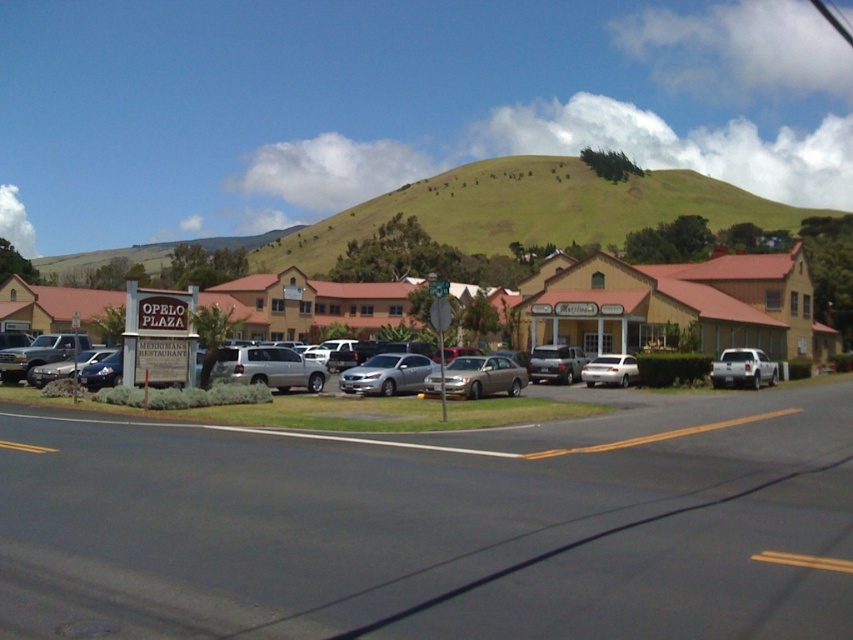
Who is more distant from viewer, (251, 257) or (552, 280)?

Point (251, 257)

Locate an element on the screen. Image resolution: width=853 pixels, height=640 pixels. green grassy hillside at upper center is located at coordinates (521, 211).

Who is taller, beige stucco building at center or white matte truck at center-right?

beige stucco building at center is taller.

Is beige stucco building at center smaller than white matte truck at center-right?

No.

You are a GUI agent. You are given a task and a screenshot of the screen. Output one action in this format:
    pyautogui.click(x=<x>, y=<y>)
    Task: Click on the beige stucco building at center
    Image resolution: width=853 pixels, height=640 pixels.
    Given the screenshot: What is the action you would take?
    pyautogui.click(x=675, y=304)

Does brown wooden motel at center appear under silver metallic sedan at center?

Incorrect, brown wooden motel at center is not positioned below silver metallic sedan at center.

Is brown wooden motel at center above silver metallic sedan at center?

Yes, brown wooden motel at center is above silver metallic sedan at center.

Describe the element at coordinates (670, 304) in the screenshot. I see `brown wooden motel at center` at that location.

Image resolution: width=853 pixels, height=640 pixels. I want to click on brown wooden motel at center, so 670,304.